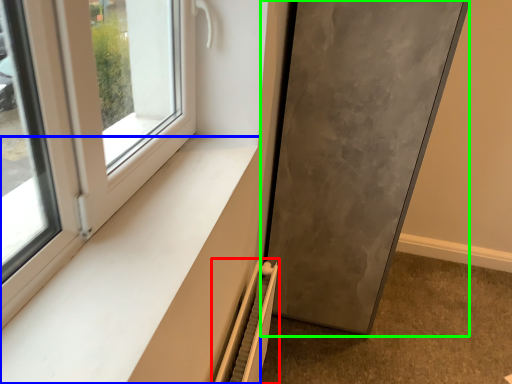
Question: Which object is the closest to the radiator (highlighted by a red box)? Choose among these: window sill (highlighted by a blue box) or door (highlighted by a green box).

Choices:
 (A) window sill
 (B) door

Answer: (A)